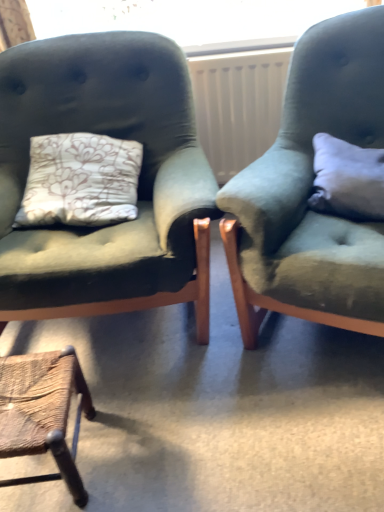
Question: Is white plastic radiator at center in front of or behind velvet green armchair at right, marked as the third chair in a left-to-right arrangement, in the image?

Choices:
 (A) front
 (B) behind

Answer: (B)

Question: Is white plastic radiator at center wider or thinner than velvet green armchair at right, marked as the third chair in a left-to-right arrangement?

Choices:
 (A) thin
 (B) wide

Answer: (A)

Question: Which is farther from the rustic wood stool at lower left, the third chair in the right-to-left sequence?

Choices:
 (A) white soft pillow at right
 (B) white plastic radiator at center
 (C) velvet green armchair at right, marked as the first chair in a right-to-left arrangement
 (D) velvet green armchair at left, placed as the second chair when sorted from right to left

Answer: (B)

Question: Estimate the real-world distances between objects in this image. Which object is farther from the white plastic radiator at center?

Choices:
 (A) velvet green armchair at right, marked as the first chair in a right-to-left arrangement
 (B) white soft pillow at right
 (C) rustic wood stool at lower left, the third chair in the right-to-left sequence
 (D) velvet green armchair at left, placed as the second chair when sorted from right to left

Answer: (C)